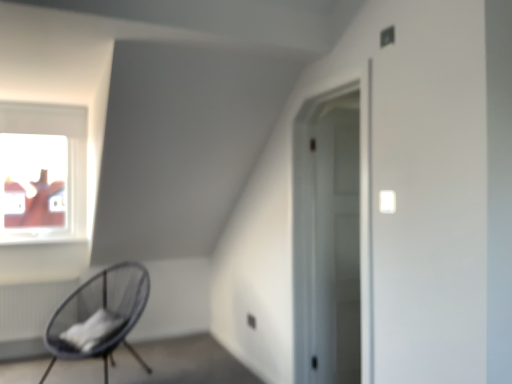
Question: Can you confirm if white textured radiator at lower left is positioned to the right of white matte door at center?

Choices:
 (A) yes
 (B) no

Answer: (B)

Question: Is white textured radiator at lower left beside white matte door at center?

Choices:
 (A) no
 (B) yes

Answer: (A)

Question: From the image's perspective, is white textured radiator at lower left beneath white matte door at center?

Choices:
 (A) no
 (B) yes

Answer: (B)

Question: Is white textured radiator at lower left not near white matte door at center?

Choices:
 (A) no
 (B) yes

Answer: (B)

Question: Is white textured radiator at lower left taller than white matte door at center?

Choices:
 (A) no
 (B) yes

Answer: (A)

Question: From the image's perspective, relative to white textured radiator at lower left, is black mesh chair at lower left above or below?

Choices:
 (A) below
 (B) above

Answer: (B)

Question: Considering the positions of black mesh chair at lower left and white textured radiator at lower left in the image, is black mesh chair at lower left bigger or smaller than white textured radiator at lower left?

Choices:
 (A) big
 (B) small

Answer: (A)

Question: Is black mesh chair at lower left inside or outside of white textured radiator at lower left?

Choices:
 (A) outside
 (B) inside

Answer: (A)

Question: In terms of width, does black mesh chair at lower left look wider or thinner when compared to white textured radiator at lower left?

Choices:
 (A) wide
 (B) thin

Answer: (A)

Question: Considering the positions of black mesh chair at lower left and white matte door at center in the image, is black mesh chair at lower left bigger or smaller than white matte door at center?

Choices:
 (A) small
 (B) big

Answer: (B)

Question: In terms of height, does black mesh chair at lower left look taller or shorter compared to white matte door at center?

Choices:
 (A) short
 (B) tall

Answer: (A)

Question: From the image's perspective, is black mesh chair at lower left located above or below white matte door at center?

Choices:
 (A) above
 (B) below

Answer: (B)

Question: Is black mesh chair at lower left in front of or behind white matte door at center in the image?

Choices:
 (A) front
 (B) behind

Answer: (A)

Question: From a real-world perspective, is white matte door at center physically located above or below white textured radiator at lower left?

Choices:
 (A) below
 (B) above

Answer: (B)

Question: Considering the positions of white matte door at center and white textured radiator at lower left in the image, is white matte door at center wider or thinner than white textured radiator at lower left?

Choices:
 (A) wide
 (B) thin

Answer: (B)